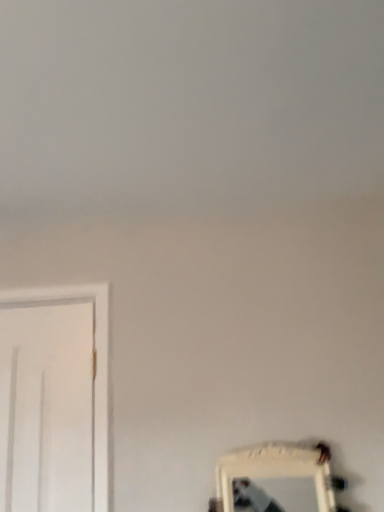
Image resolution: width=384 pixels, height=512 pixels. Describe the element at coordinates (274, 479) in the screenshot. I see `white framed mirror at lower right` at that location.

I want to click on white framed mirror at lower right, so click(274, 479).

Find the location of `white framed mirror at lower right`. white framed mirror at lower right is located at coordinates (274, 479).